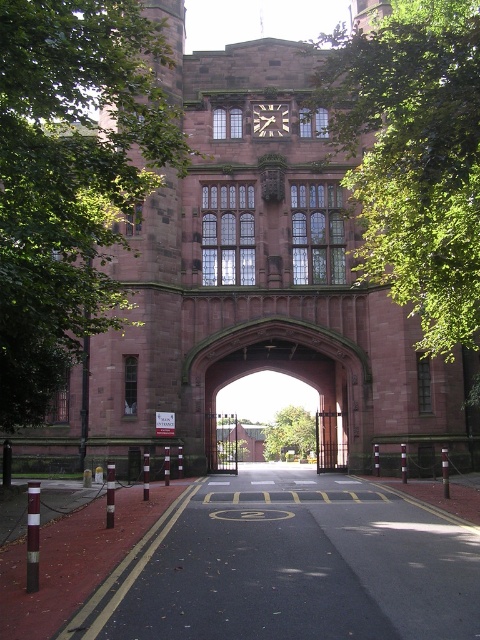
Is green leafy tree at upper left taller than green leafy tree at upper center?

In fact, green leafy tree at upper left may be shorter than green leafy tree at upper center.

Does point (92, 148) come farther from viewer compared to point (425, 145)?

Yes.

Locate an element on the screen. green leafy tree at upper left is located at coordinates (72, 179).

Between point (447, 12) and point (332, 397), which one is positioned behind?

The point (332, 397) is more distant.

Which is in front, point (358, 45) or point (331, 388)?

Point (358, 45) is in front.

Identify the location of green leafy tree at upper center. (414, 157).

Identify the location of green leafy tree at upper center. The height and width of the screenshot is (640, 480). (414, 157).

Describe the element at coordinates (414, 157) in the screenshot. The height and width of the screenshot is (640, 480). I see `green leafy tree at upper center` at that location.

Between point (415, 154) and point (288, 112), which one is positioned in front?

Point (415, 154) is in front.

You are a GUI agent. You are given a task and a screenshot of the screen. Output one action in this format:
    pyautogui.click(x=<x>, y=<y>)
    Task: Click on the green leafy tree at upper center
    
    Given the screenshot: What is the action you would take?
    pyautogui.click(x=414, y=157)